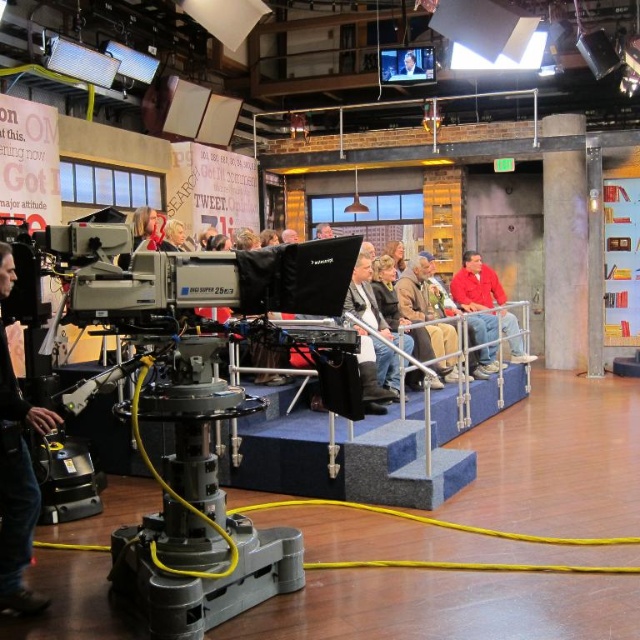
Question: Among these points, which one is nearest to the camera?

Choices:
 (A) (400, 72)
 (B) (152, 216)
 (C) (10, 464)

Answer: (C)

Question: Is red matte jacket at right positioned behind smooth skin face at upper center?

Choices:
 (A) yes
 (B) no

Answer: (B)

Question: Can you confirm if black leather jacket at lower left is thinner than blonde hair at center?

Choices:
 (A) yes
 (B) no

Answer: (B)

Question: Is red matte jacket at right bigger than blonde hair at center?

Choices:
 (A) no
 (B) yes

Answer: (B)

Question: Which object is farther from the camera taking this photo?

Choices:
 (A) red matte jacket at right
 (B) smooth skin face at upper center

Answer: (B)

Question: Which object is positioned farthest from the smooth skin face at upper center?

Choices:
 (A) black leather jacket at lower left
 (B) red matte jacket at right

Answer: (A)